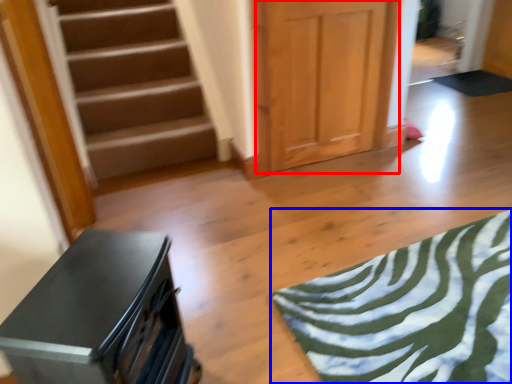
Question: Which point is closer to the camera, door (highlighted by a red box) or yoga mat (highlighted by a blue box)?

Choices:
 (A) door
 (B) yoga mat

Answer: (B)